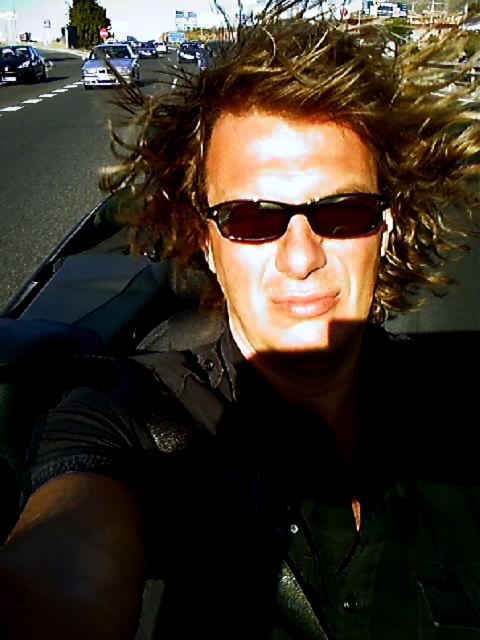
Who is more forward, (136, 64) or (149, 56)?

Point (136, 64) is more forward.

Between silver metallic sedan at upper left and shiny metallic sedan at center, which one has more height?

silver metallic sedan at upper left

Locate an element on the screen. The width and height of the screenshot is (480, 640). silver metallic sedan at upper left is located at coordinates (109, 65).

Does brown curly hair at center have a smaller size compared to shiny black sedan at left?

Actually, brown curly hair at center might be larger than shiny black sedan at left.

Consider the image. Is brown curly hair at center to the left of shiny black sedan at left from the viewer's perspective?

Incorrect, brown curly hair at center is not on the left side of shiny black sedan at left.

Who is more distant from viewer, (323, 81) or (20, 52)?

Positioned behind is point (20, 52).

You are a GUI agent. You are given a task and a screenshot of the screen. Output one action in this format:
    pyautogui.click(x=<x>, y=<y>)
    Task: Click on the brown curly hair at center
    
    Given the screenshot: What is the action you would take?
    pyautogui.click(x=316, y=120)

Find the location of a particular element. This screenshot has width=480, height=640. silver metallic sedan at upper left is located at coordinates (109, 65).

The image size is (480, 640). Identify the location of silver metallic sedan at upper left. (109, 65).